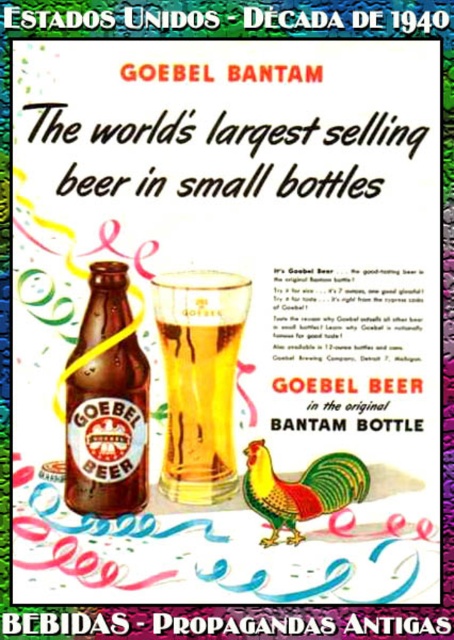
Is golden glass beer at center to the right of glossy ceramic rooster at center from the viewer's perspective?

Incorrect, golden glass beer at center is not on the right side of glossy ceramic rooster at center.

Which is behind, point (202, 356) or point (271, 497)?

The point (202, 356) is more distant.

Locate an element on the screen. The width and height of the screenshot is (454, 640). golden glass beer at center is located at coordinates (200, 380).

Is golden glass beer at center above brown glass bottle at center?

No, golden glass beer at center is not above brown glass bottle at center.

Consider the image. Who is more distant from viewer, (x=203, y=499) or (x=123, y=500)?

Positioned behind is point (x=203, y=499).

What are the coordinates of `golden glass beer at center` in the screenshot? It's located at (200, 380).

Is point (127, 426) more distant than point (277, 504)?

Yes, point (127, 426) is behind point (277, 504).

The height and width of the screenshot is (640, 454). I want to click on brown glass bottle at center, so click(x=107, y=404).